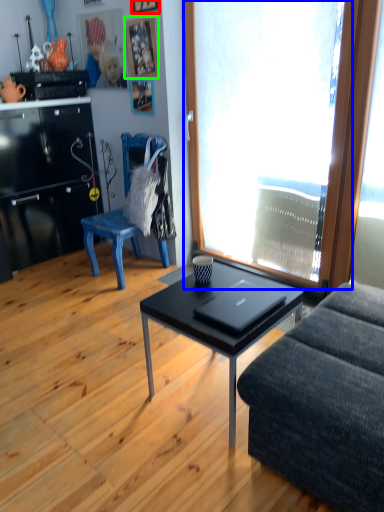
Question: Which is nearer to the picture frame (highlighted by a red box)? window (highlighted by a blue box) or picture frame (highlighted by a green box).

Choices:
 (A) window
 (B) picture frame

Answer: (B)